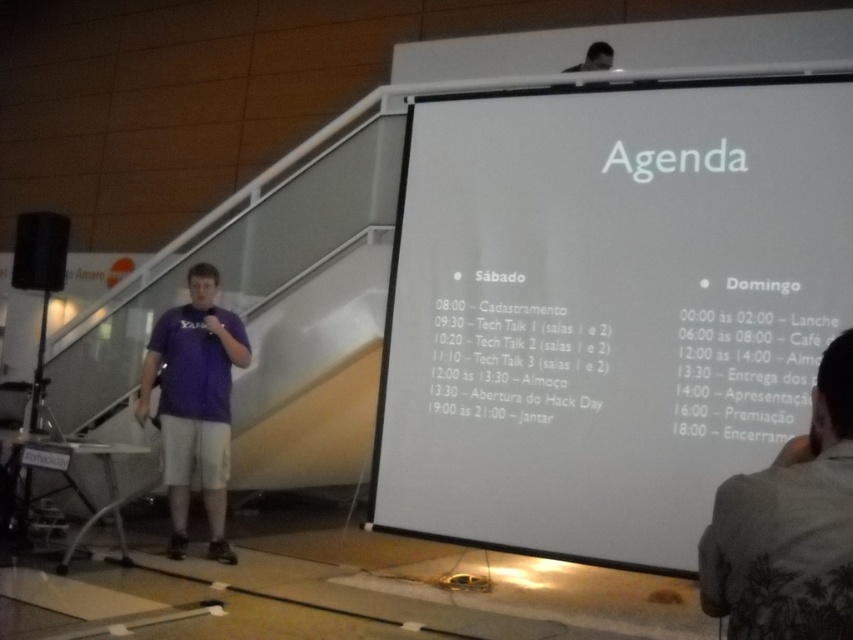
Question: Which object is the closest to the white paper at upper center?

Choices:
 (A) white paper at center
 (B) matte purple shirt at upper center
 (C) gray cotton shirt at lower right

Answer: (A)

Question: Which point is closer to the camera?

Choices:
 (A) purple fabric shirt at center
 (B) gray cotton shirt at lower right
 (C) white paper at upper center

Answer: (B)

Question: Can you confirm if white paper at upper center is wider than gray cotton shirt at lower right?

Choices:
 (A) yes
 (B) no

Answer: (A)

Question: Does gray cotton shirt at lower right lie behind white paper at center?

Choices:
 (A) no
 (B) yes

Answer: (A)

Question: Based on their relative distances, which object is nearer to the white paper at center?

Choices:
 (A) gray cotton shirt at lower right
 (B) white paper at upper center

Answer: (B)

Question: Can you confirm if gray cotton shirt at lower right is positioned to the right of white paper at center?

Choices:
 (A) no
 (B) yes

Answer: (B)